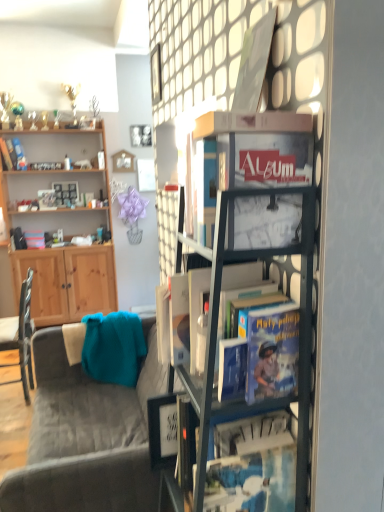
In order to face matte glass picture frame at upper center, which ranks as the fifth picture frame in back-to-front order, should I rotate leftwards or rightwards?

You should rotate right by 7.677 degrees.

What do you see at coordinates (20, 336) in the screenshot?
I see `metallic gray chair at lower left` at bounding box center [20, 336].

Find the location of a particular element. Image resolution: width=384 pixels, height=512 pixels. metallic gray chair at lower left is located at coordinates (20, 336).

Describe the element at coordinates (86, 437) in the screenshot. I see `velvet grey couch at lower left` at that location.

How much space does metallic silver picture frame at upper center, the fourth picture frame viewed from the front, occupy vertically?

It is 20.74 centimeters.

What do you see at coordinates (63, 228) in the screenshot? This screenshot has width=384, height=512. I see `wooden cabinet at left` at bounding box center [63, 228].

This screenshot has height=512, width=384. Describe the element at coordinates (156, 75) in the screenshot. I see `metallic silver picture frame at upper center, the second picture frame from the front` at that location.

Find the location of `matte glass picture frame at upper center, which ranks as the fifth picture frame in back-to-front order`. matte glass picture frame at upper center, which ranks as the fifth picture frame in back-to-front order is located at coordinates (254, 64).

Considering the positions of point (11, 167) and point (145, 178), is point (11, 167) closer or farther from the camera than point (145, 178)?

Point (11, 167) is closer to the camera than point (145, 178).

Does hardcover book at left, which is the second book in right-to-left order, come in front of matte white picture frame at upper center, the 1th picture frame from the back?

Yes, hardcover book at left, which is the second book in right-to-left order, is in front of matte white picture frame at upper center, the 1th picture frame from the back.

Would you say matte white picture frame at upper center, the 5th picture frame when ordered from front to back, is part of hardcover book at left, which is the second book in right-to-left order,'s contents?

No, matte white picture frame at upper center, the 5th picture frame when ordered from front to back, is not inside hardcover book at left, which is the second book in right-to-left order.

Which of these two, hardcover book at left, the first book viewed from the left, or hardcover book at center, which appears as the second book when viewed from the top, stands shorter?

With less height is hardcover book at left, the first book viewed from the left.

Would you say hardcover book at left, which is the second book in right-to-left order, is inside or outside hardcover book at center, the 1th book positioned from the right?

hardcover book at left, which is the second book in right-to-left order, is located beyond the bounds of hardcover book at center, the 1th book positioned from the right.

From a real-world perspective, is hardcover book at left, the first book viewed from the left, above or below hardcover book at center, the 1th book positioned from the right?

hardcover book at left, the first book viewed from the left, is above hardcover book at center, the 1th book positioned from the right.

Measure the distance between hardcover book at left, the 1th book when ordered from top to bottom, and hardcover book at center, the 2th book from the back.

hardcover book at left, the 1th book when ordered from top to bottom, and hardcover book at center, the 2th book from the back, are 3.29 meters apart from each other.

How much distance is there between velvet grey couch at lower left and metallic silver picture frame at upper center, which is counted as the 5th picture frame, starting from the right?

velvet grey couch at lower left is 8.30 feet from metallic silver picture frame at upper center, which is counted as the 5th picture frame, starting from the right.

Is metallic silver picture frame at upper center, which is counted as the 5th picture frame, starting from the right, completely or partially inside velvet grey couch at lower left?

No, metallic silver picture frame at upper center, which is counted as the 5th picture frame, starting from the right, is not inside velvet grey couch at lower left.

From the image's perspective, would you say velvet grey couch at lower left is shown under metallic silver picture frame at upper center, which is the 1th picture frame in left-to-right order?

Yes, from the image's perspective, velvet grey couch at lower left is below metallic silver picture frame at upper center, which is the 1th picture frame in left-to-right order.

Is velvet grey couch at lower left smaller than metallic silver picture frame at upper center, which is the 1th picture frame in left-to-right order?

No, velvet grey couch at lower left is not smaller than metallic silver picture frame at upper center, which is the 1th picture frame in left-to-right order.

Is metallic black easel at upper center surrounded by hardcover book at left, placed as the second book when sorted from front to back?

Definitely not — metallic black easel at upper center is not inside hardcover book at left, placed as the second book when sorted from front to back.

Does hardcover book at left, which is the second book in right-to-left order, have a greater width compared to metallic black easel at upper center?

Yes, hardcover book at left, which is the second book in right-to-left order, is wider than metallic black easel at upper center.

What's the angular difference between hardcover book at left, which is counted as the first book, starting from the back, and metallic black easel at upper center's facing directions?

The angular difference between hardcover book at left, which is counted as the first book, starting from the back, and metallic black easel at upper center is 90.2 degrees.

Considering the positions of points (22, 156) and (265, 217), is point (22, 156) closer to camera compared to point (265, 217)?

That is False.

Considering the relative positions of hardcover book at center, placed as the 1th book when sorted from front to back, and matte glass picture frame at upper center, the first picture frame positioned from the front, in the image provided, is hardcover book at center, placed as the 1th book when sorted from front to back, behind matte glass picture frame at upper center, the first picture frame positioned from the front,?

No, hardcover book at center, placed as the 1th book when sorted from front to back, is in front of matte glass picture frame at upper center, the first picture frame positioned from the front.

Is point (236, 270) in front of point (255, 90)?

No, (236, 270) is behind (255, 90).

How different are the orientations of hardcover book at center, the 2th book from the back, and matte glass picture frame at upper center, the first picture frame positioned from the front, in degrees?

The angle between the facing direction of hardcover book at center, the 2th book from the back, and the facing direction of matte glass picture frame at upper center, the first picture frame positioned from the front, is 0.0556 degrees.

How far apart are hardcover book at center, the 2th book from the back, and matte glass picture frame at upper center, placed as the fifth picture frame when sorted from left to right?

hardcover book at center, the 2th book from the back, is 49.55 centimeters from matte glass picture frame at upper center, placed as the fifth picture frame when sorted from left to right.

Based on the photo, from a real-world perspective, is matte white picture frame at upper center, the 3th picture frame when ordered from left to right, positioned under hardcover book at center, which appears as the second book when viewed from the top, based on gravity?

No.

Consider the image. Can you see matte white picture frame at upper center, the 1th picture frame from the back, touching hardcover book at center, the 1th book positioned from the right?

matte white picture frame at upper center, the 1th picture frame from the back, and hardcover book at center, the 1th book positioned from the right, are not in contact.

How different are the orientations of matte white picture frame at upper center, the 1th picture frame from the back, and hardcover book at center, arranged as the first book when ordered from the bottom, in degrees?

matte white picture frame at upper center, the 1th picture frame from the back, and hardcover book at center, arranged as the first book when ordered from the bottom, are facing 91 degrees away from each other.

In the scene shown: Which is farther from the camera, [146,175] or [258,87]?

Positioned behind is point [146,175].

Is matte white picture frame at upper center, the 3th picture frame when ordered from left to right, directly adjacent to matte glass picture frame at upper center, which ranks as the fifth picture frame in back-to-front order?

They are not placed beside each other.

Looking at this image, is matte white picture frame at upper center, marked as the 3th picture frame in a right-to-left arrangement, facing away from matte glass picture frame at upper center, which ranks as the fifth picture frame in back-to-front order?

matte white picture frame at upper center, marked as the 3th picture frame in a right-to-left arrangement, is not turned away from matte glass picture frame at upper center, which ranks as the fifth picture frame in back-to-front order.

Who is smaller, matte white picture frame at upper center, marked as the 3th picture frame in a right-to-left arrangement, or matte glass picture frame at upper center, the first picture frame positioned from the front?

Smaller between the two is matte glass picture frame at upper center, the first picture frame positioned from the front.

Where is `book above the matte white picture frame at upper center, the 3th picture frame when ordered from left to right (from a real-world perspective)`? This screenshot has width=384, height=512. book above the matte white picture frame at upper center, the 3th picture frame when ordered from left to right (from a real-world perspective) is located at coordinates (13, 154).

You are a GUI agent. You are given a task and a screenshot of the screen. Output one action in this format:
    pyautogui.click(x=<x>, y=<y>)
    Task: Click on the book lying on the left of hardcover book at center, the 1th book positioned from the right
    The height and width of the screenshot is (512, 384).
    Given the screenshot: What is the action you would take?
    pyautogui.click(x=13, y=154)

From the image, which object appears to be farther from hardcover book at center, placed as the 1th book when sorted from front to back, metallic silver picture frame at upper center, which is the 1th picture frame in left-to-right order, or metallic silver picture frame at upper center, which is the 2th picture frame in left-to-right order?

The object further to hardcover book at center, placed as the 1th book when sorted from front to back, is metallic silver picture frame at upper center, which is the 2th picture frame in left-to-right order.

Considering their positions, is matte glass picture frame at upper center, the 1th picture frame positioned from the right, positioned further to hardcover book at center, marked as the 2th book in a left-to-right arrangement, than metallic gray chair at lower left?

Among the two, metallic gray chair at lower left is located further to hardcover book at center, marked as the 2th book in a left-to-right arrangement.

Based on the photo, when comparing their distances from metallic silver picture frame at upper center, the 4th picture frame in the left-to-right sequence, does hardcover book at left, which is counted as the first book, starting from the back, or metallic silver picture frame at upper center, which appears as the second picture frame when viewed from the back, seem further?

hardcover book at left, which is counted as the first book, starting from the back.

In the scene shown: From the image, which object appears to be nearer to matte white picture frame at upper center, the 5th picture frame when ordered from front to back, hardcover book at center, the 2th book from the back, or velvet grey couch at lower left?

velvet grey couch at lower left.

Consider the image. Considering their positions, is matte white picture frame at upper center, the 5th picture frame when ordered from front to back, positioned closer to metallic silver picture frame at upper center, the fourth picture frame in the right-to-left sequence, than matte glass picture frame at upper center, the first picture frame positioned from the front?

matte white picture frame at upper center, the 5th picture frame when ordered from front to back, is closer to metallic silver picture frame at upper center, the fourth picture frame in the right-to-left sequence.

Estimate the real-world distances between objects in this image. Which object is closer to hardcover book at center, arranged as the first book when ordered from the bottom, metallic black easel at upper center or matte glass picture frame at upper center, the 1th picture frame positioned from the right?

metallic black easel at upper center lies closer to hardcover book at center, arranged as the first book when ordered from the bottom, than the other object.

In the scene shown: Considering their positions, is metallic silver picture frame at upper center, the 4th picture frame in the left-to-right sequence, positioned closer to hardcover book at left, which is counted as the first book, starting from the back, than wooden cabinet at left?

Among the two, wooden cabinet at left is located nearer to hardcover book at left, which is counted as the first book, starting from the back.

From the image, which object appears to be farther from matte glass picture frame at upper center, which ranks as the fifth picture frame in back-to-front order, matte white picture frame at upper center, the 1th picture frame from the back, or metallic silver picture frame at upper center, which appears as the fourth picture frame when viewed from the back?

Among the two, matte white picture frame at upper center, the 1th picture frame from the back, is located further to matte glass picture frame at upper center, which ranks as the fifth picture frame in back-to-front order.

This screenshot has height=512, width=384. In order to click on book between hardcover book at center, the 2th book from the back, and metallic silver picture frame at upper center, which is the 2th picture frame in left-to-right order, from front to back in this screenshot , I will do `click(13, 154)`.

Identify the location of book between metallic gray chair at lower left and matte white picture frame at upper center, the 1th picture frame from the back, from front to back. The image size is (384, 512). (13, 154).

Locate an element on the screen. book between velvet grey couch at lower left and matte white picture frame at upper center, the 1th picture frame from the back, from front to back is located at coordinates (13, 154).

At what (x,y) coordinates should I click in order to perform the action: click on cabinet located between metallic silver picture frame at upper center, the 4th picture frame in the left-to-right sequence, and hardcover book at left, the first book viewed from the left, in the depth direction. Please return your answer as a coordinate pair (x, y). This screenshot has height=512, width=384. Looking at the image, I should click on (63, 228).